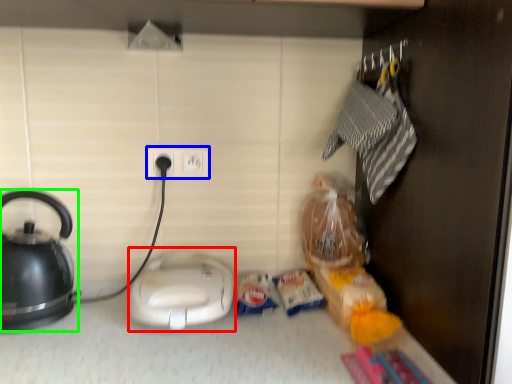
Question: Based on their relative distances, which object is farther from appliance (highlighted by a red box)? Choose from power plugs and sockets (highlighted by a blue box) and kettle (highlighted by a green box).

Choices:
 (A) power plugs and sockets
 (B) kettle

Answer: (A)